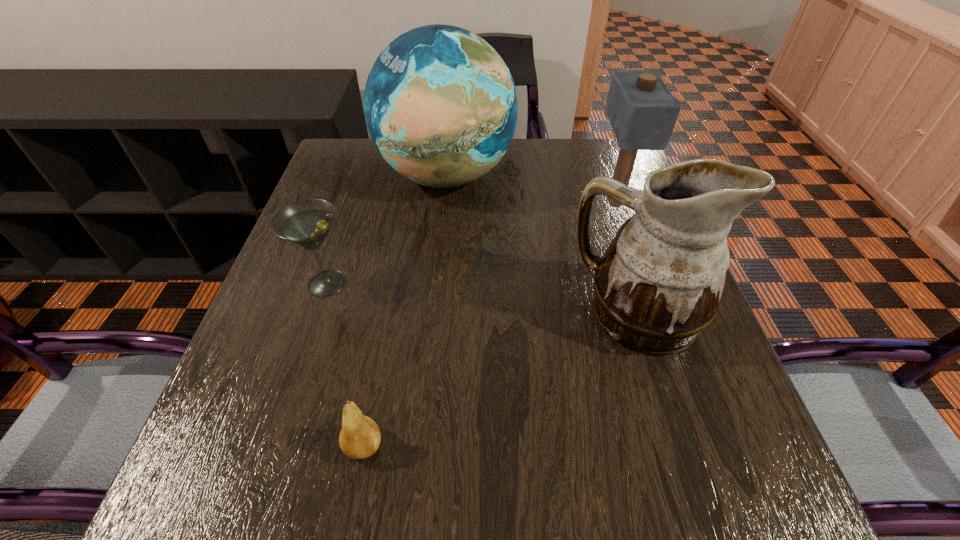
Find the location of a particular element. The width and height of the screenshot is (960, 540). globe is located at coordinates (440, 104).

The height and width of the screenshot is (540, 960). Identify the location of pitcher. (658, 285).

Locate an element on the screen. The width and height of the screenshot is (960, 540). mallet is located at coordinates point(642,111).

Locate an element on the screen. martini is located at coordinates (307, 222).

This screenshot has height=540, width=960. In order to click on the shortest object in this screenshot , I will do `click(360, 436)`.

Locate an element on the screen. This screenshot has height=540, width=960. pear is located at coordinates (360, 436).

I want to click on vacant space situated on the left of the globe, so click(360, 176).

The width and height of the screenshot is (960, 540). Find the location of `blank area located from the spout of the pitcher`. blank area located from the spout of the pitcher is located at coordinates (401, 314).

In order to click on blank space located 0.070m from the spout of the pitcher in this screenshot , I will do `click(537, 314)`.

Locate an element on the screen. This screenshot has width=960, height=540. vacant space located from the spout of the pitcher is located at coordinates (512, 314).